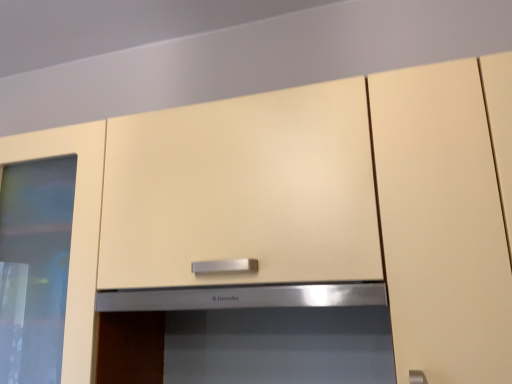
The height and width of the screenshot is (384, 512). I want to click on satin silver exhaust hood at center, so click(x=243, y=296).

The image size is (512, 384). Describe the element at coordinates (243, 296) in the screenshot. I see `satin silver exhaust hood at center` at that location.

At what (x,y) coordinates should I click in order to perform the action: click on satin silver exhaust hood at center. Please return your answer as a coordinate pair (x, y). The width and height of the screenshot is (512, 384). Looking at the image, I should click on (243, 296).